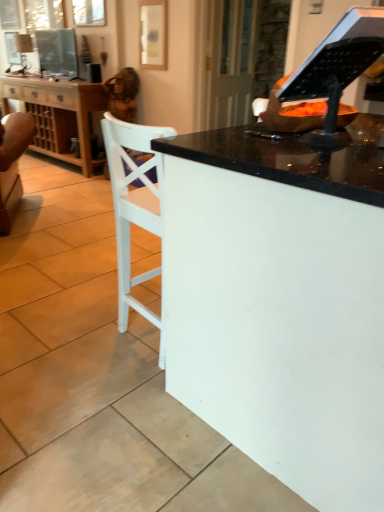
Question: In terms of width, does matte wooden picture frame at upper center look wider or thinner when compared to white glossy desk at center?

Choices:
 (A) thin
 (B) wide

Answer: (A)

Question: From a real-world perspective, relative to white glossy desk at center, is matte wooden picture frame at upper center vertically above or below?

Choices:
 (A) below
 (B) above

Answer: (B)

Question: Considering the real-world distances, which object is closest to the matte black tv at upper left?

Choices:
 (A) wooden cabinet at left
 (B) transparent glass door at upper center
 (C) matte wooden picture frame at upper center
 (D) black plastic music stand at upper right
 (E) white glossy desk at center

Answer: (A)

Question: Which object is the closest to the white glossy desk at center?

Choices:
 (A) matte wooden picture frame at upper center
 (B) transparent glass door at upper center
 (C) black plastic music stand at upper right
 (D) matte black tv at upper left
 (E) wooden cabinet at left

Answer: (C)